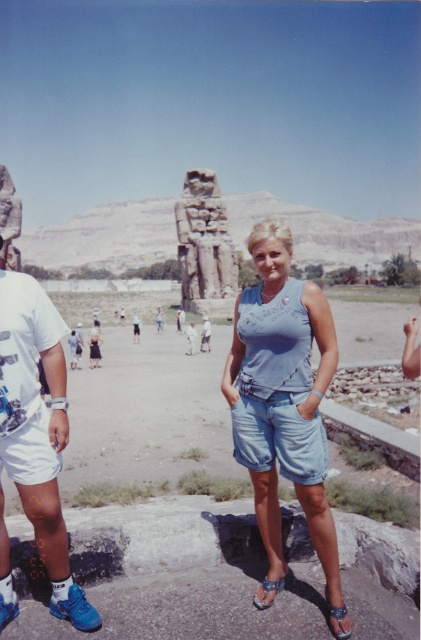
Is point (335, 344) closer to camera compared to point (333, 618)?

No, (335, 344) is behind (333, 618).

Is light blue denim shorts at center positioned at the back of leather sandal at lower right?

Yes, light blue denim shorts at center is behind leather sandal at lower right.

Between point (260, 291) and point (327, 602), which one is positioned behind?

Positioned behind is point (260, 291).

Where is `light blue denim shorts at center`? The image size is (421, 640). light blue denim shorts at center is located at coordinates (282, 396).

Who is more distant from viewer, (x=50, y=609) or (x=186, y=262)?

The point (x=186, y=262) is behind.

Can you confirm if blue synthetic sneakers at lower left is bigger than carved stone statue at center?

No, blue synthetic sneakers at lower left is not bigger than carved stone statue at center.

Who is more distant from viewer, (47, 515) or (226, 225)?

Point (226, 225)

Locate an element on the screen. The width and height of the screenshot is (421, 640). blue synthetic sneakers at lower left is located at coordinates (37, 429).

Which is more to the right, light blue denim shorts at center or blue synthetic sneakers at lower left?

From the viewer's perspective, light blue denim shorts at center appears more on the right side.

Where is `light blue denim shorts at center`? This screenshot has height=640, width=421. light blue denim shorts at center is located at coordinates (282, 396).

Locate an element on the screen. The height and width of the screenshot is (640, 421). light blue denim shorts at center is located at coordinates (282, 396).